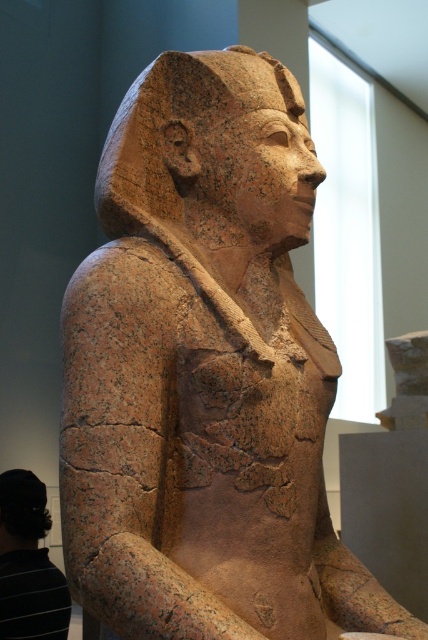
Can you confirm if granite statue at center is positioned below matte brown statue head at center?

→ Incorrect, granite statue at center is not positioned below matte brown statue head at center.

You are a GUI agent. You are given a task and a screenshot of the screen. Output one action in this format:
    pyautogui.click(x=<x>, y=<y>)
    Task: Click on the granite statue at center
    The image size is (428, 640).
    Given the screenshot: What is the action you would take?
    pyautogui.click(x=180, y=132)

Is black striped shirt at lower left taller than matte brown statue head at center?

Yes, black striped shirt at lower left is taller than matte brown statue head at center.

Can you confirm if black striped shirt at lower left is positioned below matte brown statue head at center?

Indeed, black striped shirt at lower left is positioned under matte brown statue head at center.

Between point (39, 584) and point (23, 477), which one is positioned in front?

Point (39, 584) is more forward.

Where is `black striped shirt at lower left`? black striped shirt at lower left is located at coordinates (29, 563).

Who is positioned more to the left, granite statue at center or black striped shirt at lower left?

Positioned to the left is black striped shirt at lower left.

Does granite statue at center appear on the left side of black striped shirt at lower left?

No, granite statue at center is not to the left of black striped shirt at lower left.

This screenshot has height=640, width=428. I want to click on granite statue at center, so click(x=180, y=132).